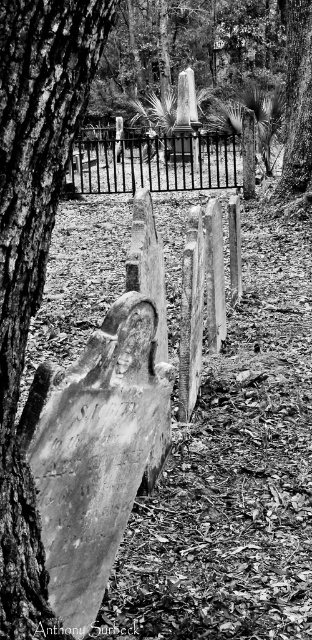
You are standing at the entrance of the cemetery and see two points marked in the image. The first point is at coordinates point (44,115) and the second point is at point (115,154). Which point is closer to you?

Point (44,115) is in front of point (115,154), so it is closer to you.

You are standing in the cemetery scene shown in the image. You want to walk directly toward the metal fence in the background. Which direction should you face to avoid the smooth bark tree trunk at left?

You should face toward the right side of the smooth bark tree trunk at left to avoid it while walking toward the metal fence in the background.